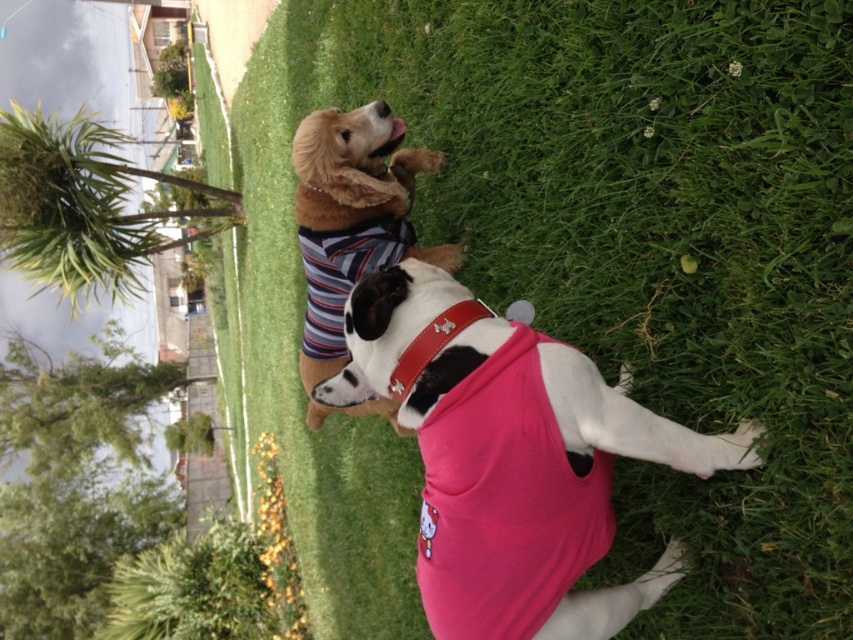
Question: Among these objects, which one is nearest to the camera?

Choices:
 (A) striped fabric dog at upper left
 (B) pink fabric dog at center

Answer: (B)

Question: Is pink fabric dog at center positioned before striped fabric dog at upper left?

Choices:
 (A) yes
 (B) no

Answer: (A)

Question: Which point is closer to the camera?

Choices:
 (A) pink fabric dog at center
 (B) striped fabric dog at upper left

Answer: (A)

Question: Can you confirm if pink fabric dog at center is smaller than striped fabric dog at upper left?

Choices:
 (A) no
 (B) yes

Answer: (B)

Question: Does pink fabric dog at center have a larger size compared to striped fabric dog at upper left?

Choices:
 (A) no
 (B) yes

Answer: (A)